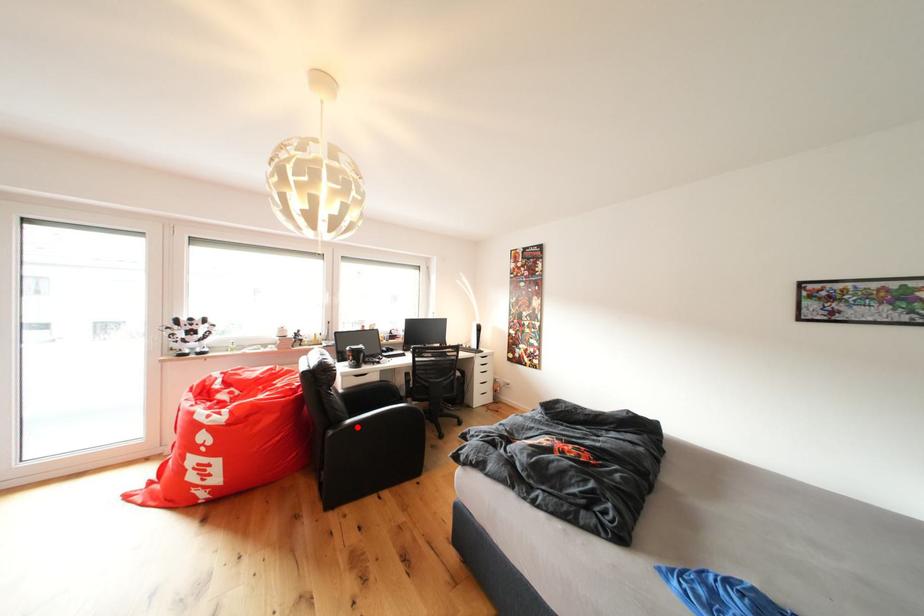
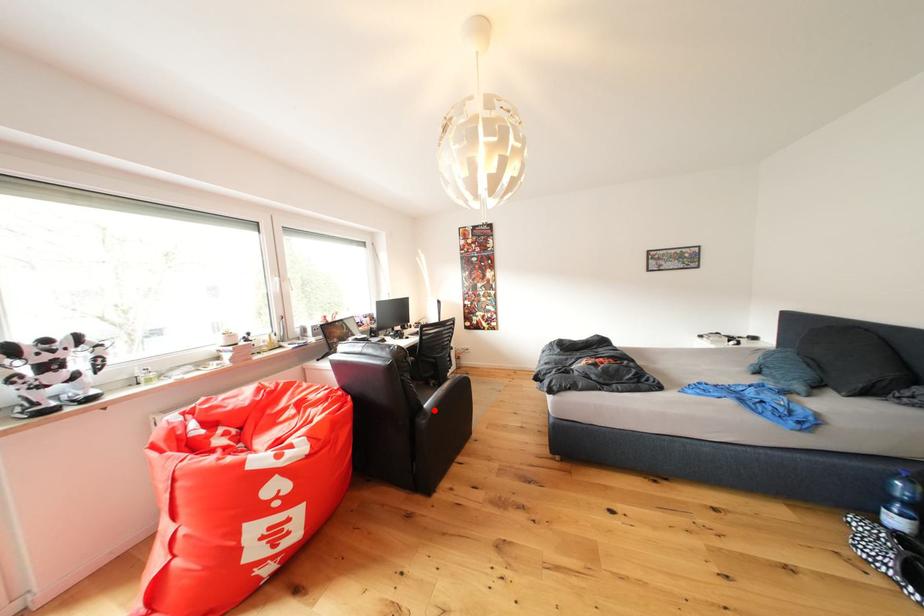
I am providing you with two images of the same scene from different viewpoints. A red point is marked on the first image and another point is marked on the second image. Does the point marked in image1 correspond to the same location as the one in image2?

Yes